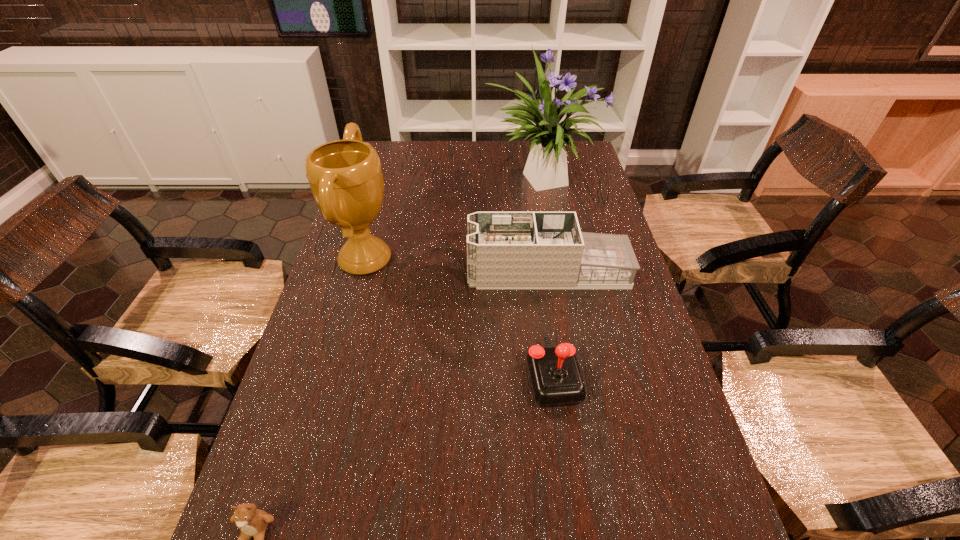
Image resolution: width=960 pixels, height=540 pixels. Find the location of `empty space between the fourth farthest object and the award`. empty space between the fourth farthest object and the award is located at coordinates (459, 318).

The height and width of the screenshot is (540, 960). I want to click on vacant point located between the joystick and the dollhouse, so click(550, 323).

Choose which object is the third nearest neighbor to the second tallest object. Please provide its 2D coordinates. Your answer should be formatted as a tuple, i.e. [(x, y)], where the tuple contains the x and y coordinates of a point satisfying the conditions above.

[(556, 380)]

Identify which object is the nearest to the teddy bear. Please provide its 2D coordinates. Your answer should be formatted as a tuple, i.e. [(x, y)], where the tuple contains the x and y coordinates of a point satisfying the conditions above.

[(556, 380)]

This screenshot has height=540, width=960. Find the location of `blank area in the image that satisfies the following two spatial constraints: 1. on the back side of the farthest object; 2. on the left side of the fourth farthest object`. blank area in the image that satisfies the following two spatial constraints: 1. on the back side of the farthest object; 2. on the left side of the fourth farthest object is located at coordinates (525, 177).

I want to click on free space that satisfies the following two spatial constraints: 1. on the back side of the flower arrangement; 2. on the left side of the joystick, so click(x=525, y=177).